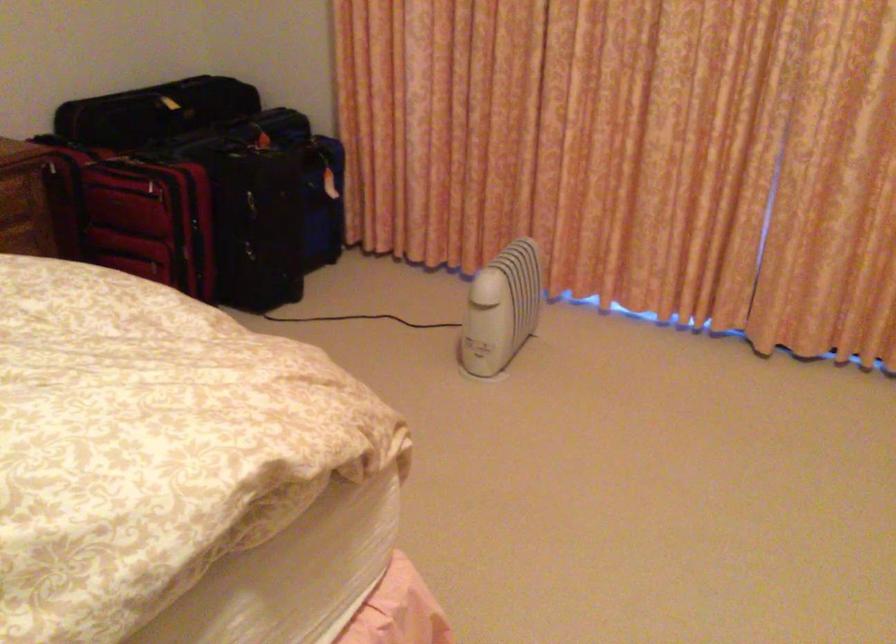
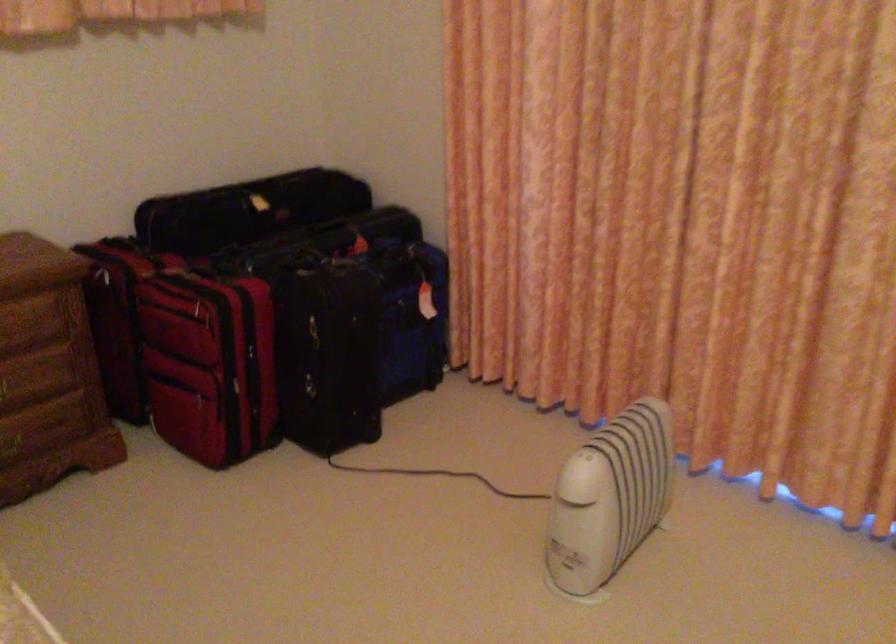
Question: What movement of the cameraman would produce the second image?

Choices:
 (A) Left
 (B) Right
 (C) Forward
 (D) Backward

Answer: (C)